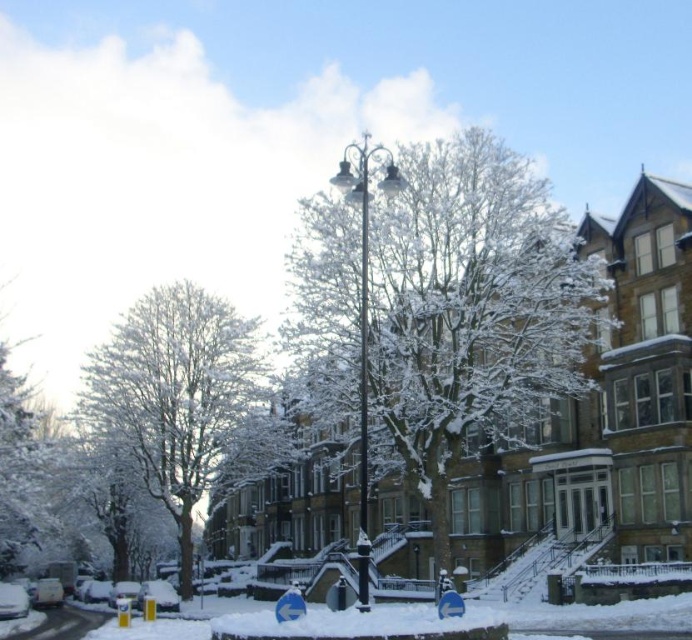
Question: Which object is positioned closest to the white snow-covered tree at center?

Choices:
 (A) metallic silver pole at center
 (B) white snow-covered tree at left

Answer: (B)

Question: Is white snow-covered tree at center below metallic silver pole at center?

Choices:
 (A) yes
 (B) no

Answer: (A)

Question: Which object is positioned farthest from the white snow-covered tree at left?

Choices:
 (A) white snow-covered tree at center
 (B) snow-covered tree at center
 (C) metallic silver pole at center

Answer: (C)

Question: Which point is closer to the camera taking this photo?

Choices:
 (A) (363, 428)
 (B) (6, 477)

Answer: (A)

Question: Is white snow-covered tree at center positioned at the back of metallic silver pole at center?

Choices:
 (A) no
 (B) yes

Answer: (B)

Question: Does black metal streetlight at center appear under metallic silver pole at center?

Choices:
 (A) yes
 (B) no

Answer: (A)